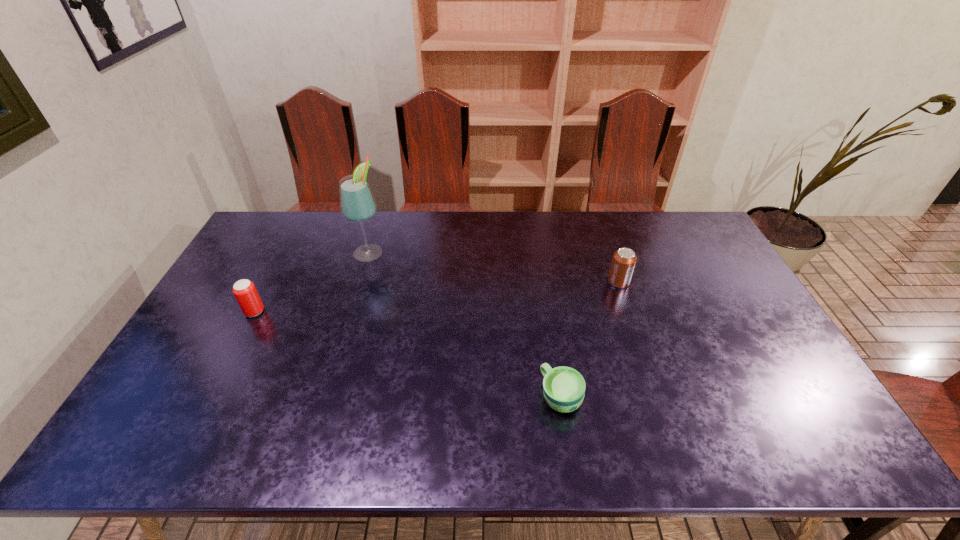
Find the location of a particular element. The width and height of the screenshot is (960, 540). free space that is in between the alcohol and the nearest object is located at coordinates (465, 324).

Find the location of `vacant region between the tallest object and the second object from right to left`. vacant region between the tallest object and the second object from right to left is located at coordinates (465, 324).

Identify the location of free area in between the tallest object and the can. This screenshot has width=960, height=540. (493, 267).

Identify the location of unoccupied area between the second object from right to left and the beer can. The height and width of the screenshot is (540, 960). (408, 354).

Locate an element on the screen. The width and height of the screenshot is (960, 540). vacant space that's between the alcohol and the rightmost object is located at coordinates (493, 267).

This screenshot has width=960, height=540. I want to click on free spot between the can and the beer can, so click(437, 296).

Where is `free spot between the second farthest object and the tallest object`? The width and height of the screenshot is (960, 540). free spot between the second farthest object and the tallest object is located at coordinates (493, 267).

Where is `free space between the leftmost object and the second object from right to left`? This screenshot has height=540, width=960. free space between the leftmost object and the second object from right to left is located at coordinates (408, 354).

In order to click on empty location between the second farthest object and the beer can in this screenshot , I will do `click(437, 296)`.

Point out which object is positioned as the second nearest to the leftmost object. Please provide its 2D coordinates. Your answer should be formatted as a tuple, i.e. [(x, y)], where the tuple contains the x and y coordinates of a point satisfying the conditions above.

[(564, 388)]